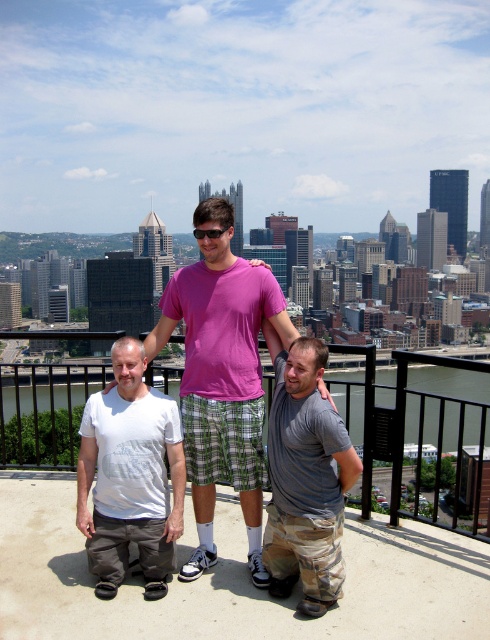
Question: In this image, where is white cotton t-shirt at lower left located relative to gray cotton t-shirt at center?

Choices:
 (A) left
 (B) right

Answer: (A)

Question: Based on their relative distances, which object is nearer to the pink cotton t-shirt at center?

Choices:
 (A) black plastic goggles at center
 (B) gray cotton t-shirt at center

Answer: (B)

Question: Which object appears farthest from the camera in this image?

Choices:
 (A) gray cotton t-shirt at center
 (B) pink cotton t-shirt at center

Answer: (B)

Question: In this image, where is white cotton t-shirt at lower left located relative to gray cotton t-shirt at center?

Choices:
 (A) left
 (B) right

Answer: (A)

Question: Which of these objects is positioned closest to the white cotton t-shirt at lower left?

Choices:
 (A) black plastic goggles at center
 (B) gray cotton t-shirt at center
 (C) pink cotton t-shirt at center

Answer: (C)

Question: Is white cotton t-shirt at lower left below black plastic goggles at center?

Choices:
 (A) no
 (B) yes

Answer: (B)